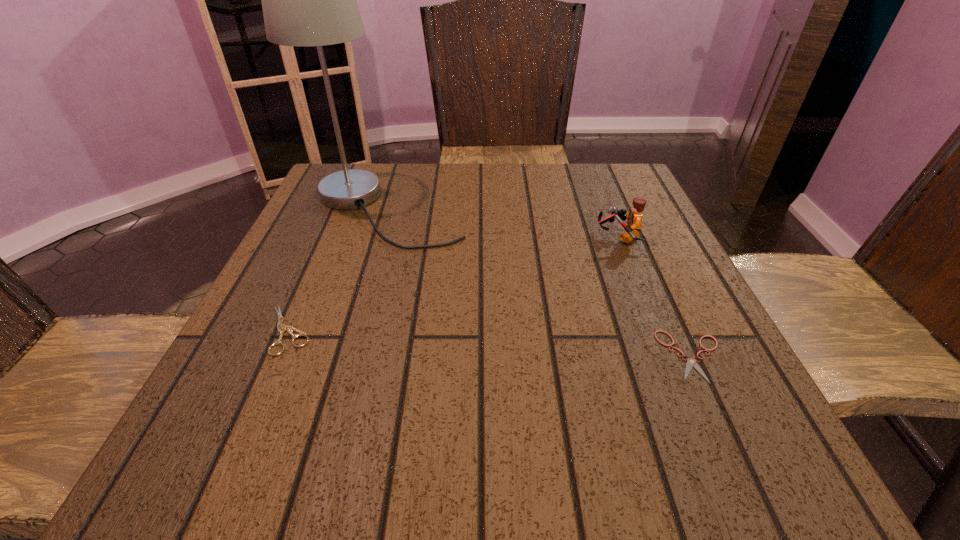
I want to click on table lamp, so click(308, 0).

At what (x,y) coordinates should I click in order to perform the action: click on the second tallest object. Please return your answer as a coordinate pair (x, y). Looking at the image, I should click on (634, 218).

Locate an element on the screen. The height and width of the screenshot is (540, 960). the left shears is located at coordinates (282, 329).

Find the location of `the third tallest object`. the third tallest object is located at coordinates tap(282, 329).

You are a GUI agent. You are given a task and a screenshot of the screen. Output one action in this format:
    pyautogui.click(x=<x>, y=<y>)
    Task: Click on the shorter shears
    
    Given the screenshot: What is the action you would take?
    pyautogui.click(x=691, y=362)

Locate an element on the screen. This screenshot has height=540, width=960. the shortest object is located at coordinates (691, 362).

Locate an element on the screen. The image size is (960, 540). free spot located on the right of the tallest object is located at coordinates 598,209.

Locate an element on the screen. Image resolution: width=960 pixels, height=540 pixels. free space located holding a crossbow in the hands of the Lego is located at coordinates (492, 238).

Locate an element on the screen. The image size is (960, 540). free region located holding a crossbow in the hands of the Lego is located at coordinates click(x=512, y=238).

The height and width of the screenshot is (540, 960). I want to click on blank space located 0.370m holding a crossbow in the hands of the Lego, so click(421, 238).